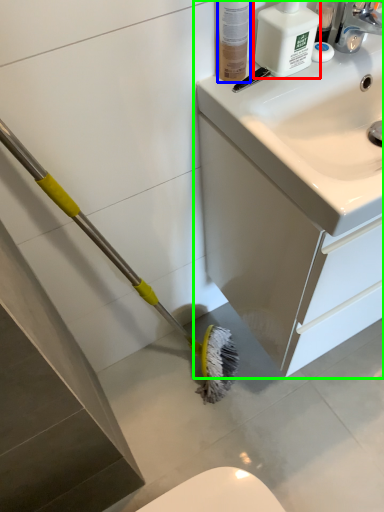
Question: Based on their relative distances, which object is nearer to cleaning product (highlighted by a red box)? Choose from toiletry (highlighted by a blue box) and bathroom cabinet (highlighted by a green box).

Choices:
 (A) toiletry
 (B) bathroom cabinet

Answer: (A)